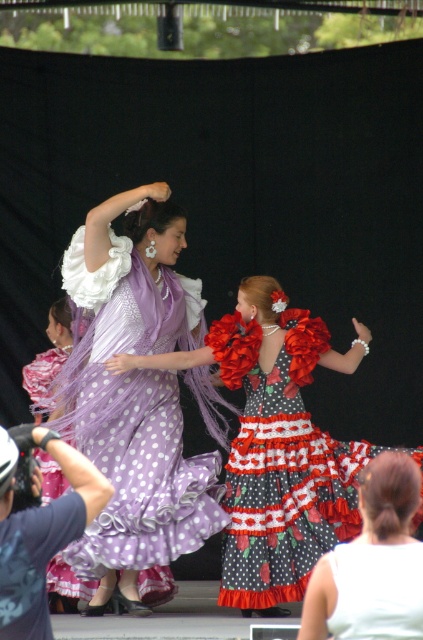
Question: Which point is farther to the camera?

Choices:
 (A) (307, 310)
 (B) (154, 385)

Answer: (B)

Question: Is lavender tulle dress at center above polka dot fabric dress at center?

Choices:
 (A) no
 (B) yes

Answer: (B)

Question: Which point is closer to the camera?

Choices:
 (A) (167, 472)
 (B) (404, 600)
 (C) (244, 380)

Answer: (B)

Question: Can you confirm if lavender tulle dress at center is positioned to the right of polka dot fabric dress at center?

Choices:
 (A) no
 (B) yes

Answer: (A)

Question: Which of the following is the closest to the observer?

Choices:
 (A) tap(296, 545)
 (B) tap(186, 312)
 (C) tap(395, 500)

Answer: (C)

Question: Can you confirm if lavender tulle dress at center is smaller than polka dot fabric dress at center?

Choices:
 (A) no
 (B) yes

Answer: (A)